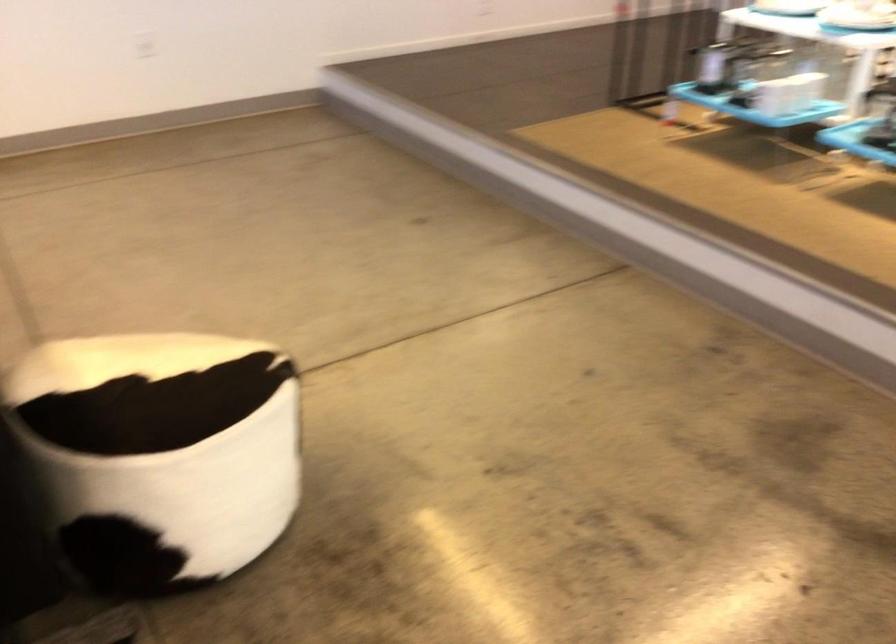
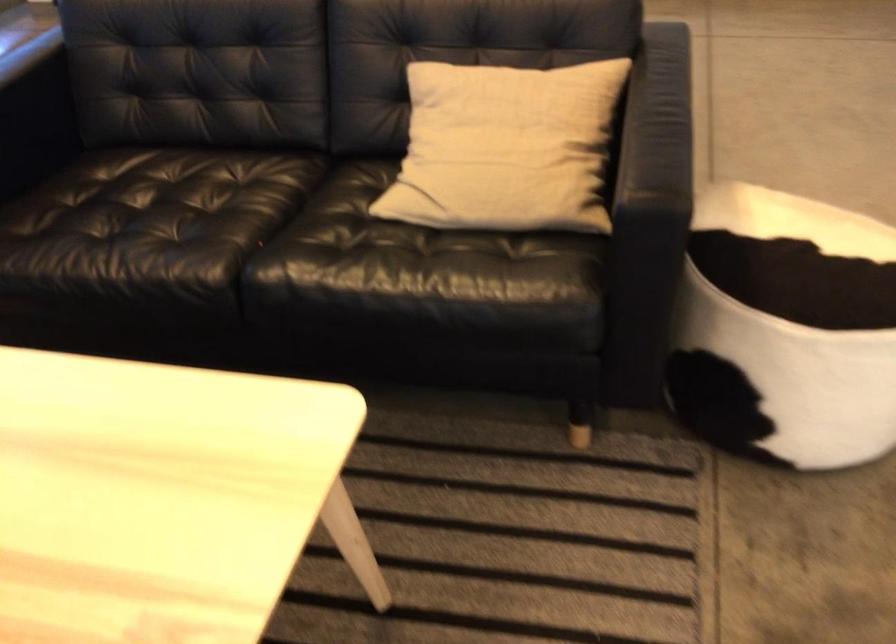
In the second image, find the point that corresponds to [152,457] in the first image.

(786, 330)